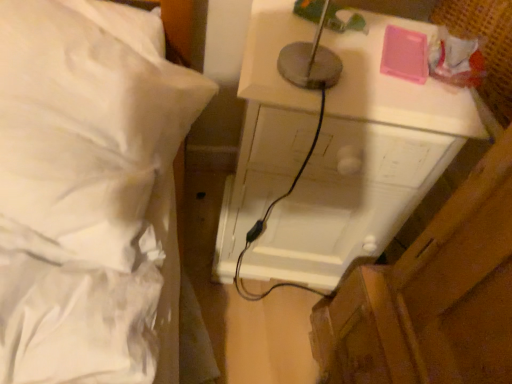
Question: Is white soft bed at upper left facing towards white glossy nightstand at upper right?

Choices:
 (A) yes
 (B) no

Answer: (B)

Question: From the image's perspective, is white soft bed at upper left beneath white glossy nightstand at upper right?

Choices:
 (A) yes
 (B) no

Answer: (B)

Question: Can you confirm if white soft bed at upper left is taller than white glossy nightstand at upper right?

Choices:
 (A) yes
 (B) no

Answer: (B)

Question: Can you confirm if white soft bed at upper left is thinner than white glossy nightstand at upper right?

Choices:
 (A) yes
 (B) no

Answer: (B)

Question: Does white soft bed at upper left have a larger size compared to white glossy nightstand at upper right?

Choices:
 (A) no
 (B) yes

Answer: (A)

Question: Is white glossy nightstand at upper right located within white soft bed at upper left?

Choices:
 (A) yes
 (B) no

Answer: (B)

Question: Is the position of white glossy nightstand at upper right less distant than that of white soft bed at upper left?

Choices:
 (A) yes
 (B) no

Answer: (B)

Question: Is white glossy nightstand at upper right positioned beyond the bounds of white soft bed at upper left?

Choices:
 (A) no
 (B) yes

Answer: (B)

Question: Is white glossy nightstand at upper right not near white soft bed at upper left?

Choices:
 (A) yes
 (B) no

Answer: (B)

Question: Can you confirm if white glossy nightstand at upper right is thinner than white soft bed at upper left?

Choices:
 (A) yes
 (B) no

Answer: (A)

Question: Are white glossy nightstand at upper right and white soft bed at upper left making contact?

Choices:
 (A) no
 (B) yes

Answer: (A)

Question: Is white glossy nightstand at upper right aimed at white soft bed at upper left?

Choices:
 (A) no
 (B) yes

Answer: (A)

Question: Relative to white soft bed at upper left, is white glossy nightstand at upper right in front or behind?

Choices:
 (A) front
 (B) behind

Answer: (B)